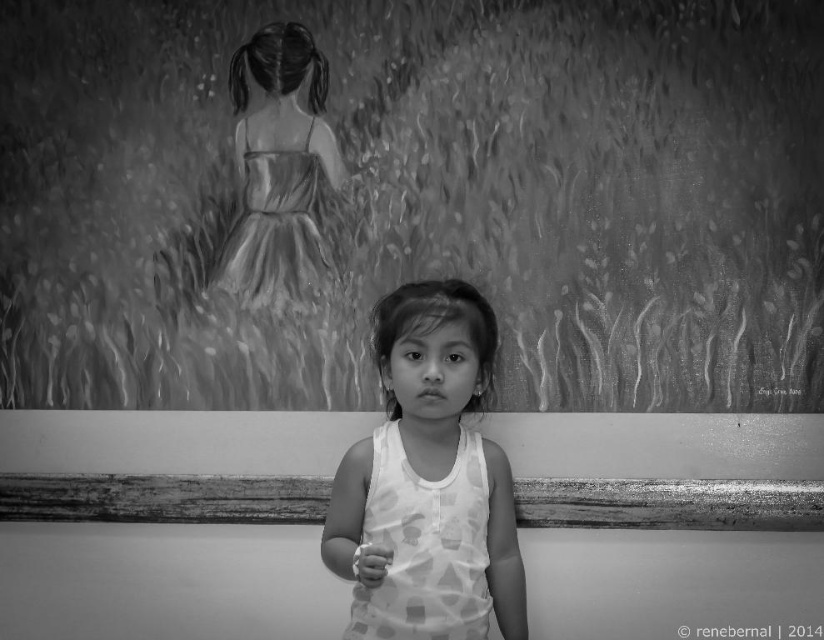
Question: Is white dotted tank top at center to the left of satin-like dress at upper center from the viewer's perspective?

Choices:
 (A) yes
 (B) no

Answer: (B)

Question: Among these points, which one is nearest to the camera?

Choices:
 (A) (452, 516)
 (B) (520, 620)
 (C) (314, 278)

Answer: (A)

Question: Which object is closer to the camera taking this photo?

Choices:
 (A) satin-like dress at upper center
 (B) white dotted fabric dress at center

Answer: (B)

Question: Does white dotted fabric dress at center appear over satin-like dress at upper center?

Choices:
 (A) yes
 (B) no

Answer: (B)

Question: Can you confirm if white dotted fabric dress at center is smaller than satin-like dress at upper center?

Choices:
 (A) yes
 (B) no

Answer: (B)

Question: Among these objects, which one is farthest from the camera?

Choices:
 (A) satin-like dress at upper center
 (B) white dotted fabric dress at center

Answer: (A)